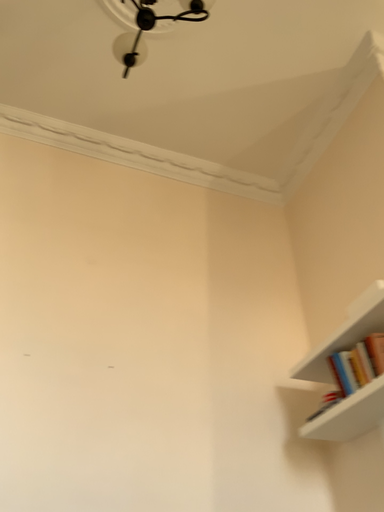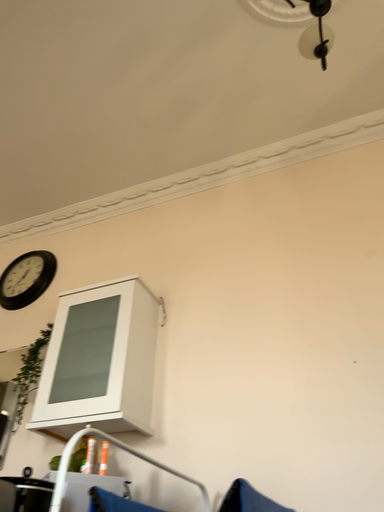
Question: How did the camera likely rotate when shooting the video?

Choices:
 (A) rotated downward
 (B) rotated upward

Answer: (A)